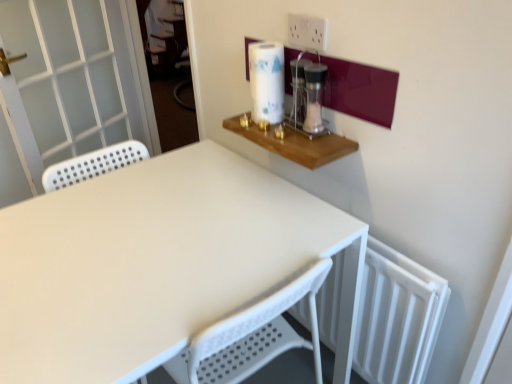
Locate an element on the screen. The image size is (512, 384). white glossy paper towel at upper right is located at coordinates (267, 81).

Identify the location of clear glass jar at upper right. (307, 95).

Locate an element on the screen. The image size is (512, 384). white perforated screen door at left is located at coordinates (74, 79).

The image size is (512, 384). What do you see at coordinates (307, 32) in the screenshot? I see `white plastic electric outlet at upper center` at bounding box center [307, 32].

Describe the element at coordinates (158, 264) in the screenshot. The width and height of the screenshot is (512, 384). I see `white matte table at center` at that location.

Where is `white glossy paper towel at upper right`? white glossy paper towel at upper right is located at coordinates (267, 81).

Does white perforated screen door at left have a lesser width compared to white glossy paper towel at upper right?

No, white perforated screen door at left is not thinner than white glossy paper towel at upper right.

From the image's perspective, between white perforated screen door at left and white glossy paper towel at upper right, who is located below?

From the image's view, white glossy paper towel at upper right is below.

Does white perforated screen door at left contain white glossy paper towel at upper right?

Definitely not — white glossy paper towel at upper right is not inside white perforated screen door at left.

From a real-world perspective, which is physically below, white perforated screen door at left or white glossy paper towel at upper right?

From a 3D spatial view, white perforated screen door at left is below.

Identify the location of screen door lying behind the white matte table at center. click(74, 79).

Considering the positions of objects white matte table at center and white perforated screen door at left in the image provided, who is more to the left, white matte table at center or white perforated screen door at left?

From the viewer's perspective, white perforated screen door at left appears more on the left side.

Based on the photo, is white matte table at center far from white perforated screen door at left?

Absolutely, white matte table at center is distant from white perforated screen door at left.

Is white matte table at center closer to camera compared to white perforated screen door at left?

Yes, it is.

Considering the sizes of objects clear glass salt shaker at upper center and white glossy paper towel at upper right in the image provided, who is bigger, clear glass salt shaker at upper center or white glossy paper towel at upper right?

white glossy paper towel at upper right.

From a real-world perspective, between clear glass salt shaker at upper center and white glossy paper towel at upper right, who is vertically lower?

In real-world perspective, clear glass salt shaker at upper center is lower.

Considering the points (298, 83) and (254, 120), which point is in front, point (298, 83) or point (254, 120)?

Point (298, 83)

Consider the image. Is clear glass salt shaker at upper center to the left of white glossy paper towel at upper right from the viewer's perspective?

In fact, clear glass salt shaker at upper center is to the right of white glossy paper towel at upper right.

How different are the orientations of white perforated screen door at left and white matte table at center in degrees?

white perforated screen door at left and white matte table at center are facing 156 degrees away from each other.

Considering the relative sizes of white perforated screen door at left and white matte table at center in the image provided, is white perforated screen door at left shorter than white matte table at center?

No, white perforated screen door at left is not shorter than white matte table at center.

Looking at the image, does white perforated screen door at left seem bigger or smaller compared to white matte table at center?

white perforated screen door at left is smaller than white matte table at center.

Choose the correct answer: Is white perforated screen door at left inside white matte table at center or outside it?

white perforated screen door at left lies outside white matte table at center.

Considering the relative sizes of white glossy paper towel at upper right and clear glass jar at upper right in the image provided, is white glossy paper towel at upper right wider than clear glass jar at upper right?

Correct, the width of white glossy paper towel at upper right exceeds that of clear glass jar at upper right.

Is white glossy paper towel at upper right taller or shorter than clear glass jar at upper right?

Considering their sizes, white glossy paper towel at upper right has more height than clear glass jar at upper right.

From the image's perspective, between white glossy paper towel at upper right and clear glass jar at upper right, who is located below?

clear glass jar at upper right appears lower in the image.

From the image's perspective, is white plastic electric outlet at upper center beneath white glossy paper towel at upper right?

Incorrect, from the image's perspective, white plastic electric outlet at upper center is higher than white glossy paper towel at upper right.

Is white plastic electric outlet at upper center positioned with its back to white glossy paper towel at upper right?

No, white plastic electric outlet at upper center is not facing away from white glossy paper towel at upper right.

Can you confirm if white plastic electric outlet at upper center is shorter than white glossy paper towel at upper right?

Correct, white plastic electric outlet at upper center is not as tall as white glossy paper towel at upper right.

From a real-world perspective, between white plastic electric outlet at upper center and white glossy paper towel at upper right, who is vertically lower?

In real-world perspective, white glossy paper towel at upper right is lower.

From a real-world perspective, which is physically above, clear glass jar at upper right or white matte table at center?

clear glass jar at upper right, from a real-world perspective.

Relative to white matte table at center, is clear glass jar at upper right in front or behind?

Visually, clear glass jar at upper right is located behind white matte table at center.

What are the coordinates of `coffee machine above the white matte table at center (from a real-world perspective)` in the screenshot? It's located at (307, 95).

Locate an element on the screen. screen door on the left of white glossy paper towel at upper right is located at coordinates (74, 79).

You are a GUI agent. You are given a task and a screenshot of the screen. Output one action in this format:
    pyautogui.click(x=<x>, y=<y>)
    Task: Click on the table below the white perforated screen door at left (from a real-world perspective)
    Image resolution: width=512 pixels, height=384 pixels.
    Given the screenshot: What is the action you would take?
    pyautogui.click(x=158, y=264)

From the image, which object appears to be farther from clear glass salt shaker at upper center, white matte table at center or white plastic electric outlet at upper center?

Based on the image, white matte table at center appears to be further to clear glass salt shaker at upper center.

Considering their positions, is clear glass salt shaker at upper center positioned further to white plastic electric outlet at upper center than white perforated screen door at left?

Among the two, white perforated screen door at left is located further to white plastic electric outlet at upper center.

When comparing their distances from clear glass salt shaker at upper center, does white perforated screen door at left or white glossy paper towel at upper right seem closer?

The object closer to clear glass salt shaker at upper center is white glossy paper towel at upper right.

Which object lies further to the anchor point white plastic electric outlet at upper center, white glossy paper towel at upper right or clear glass jar at upper right?

white glossy paper towel at upper right.

From the image, which object appears to be farther from clear glass salt shaker at upper center, white perforated screen door at left or white plastic electric outlet at upper center?

white perforated screen door at left is further to clear glass salt shaker at upper center.

From the image, which object appears to be nearer to white perforated screen door at left, clear glass salt shaker at upper center or white plastic electric outlet at upper center?

clear glass salt shaker at upper center is closer to white perforated screen door at left.

Which object lies further to the anchor point clear glass salt shaker at upper center, clear glass jar at upper right or white matte table at center?

white matte table at center.

From the image, which object appears to be farther from clear glass jar at upper right, clear glass salt shaker at upper center or white glossy paper towel at upper right?

Based on the image, white glossy paper towel at upper right appears to be further to clear glass jar at upper right.

In order to click on paper towel between white plastic electric outlet at upper center and clear glass jar at upper right vertically in this screenshot , I will do `click(267, 81)`.

I want to click on table located between white perforated screen door at left and white plastic electric outlet at upper center in the left-right direction, so click(158, 264).

In order to click on paper towel between white perforated screen door at left and clear glass jar at upper right in this screenshot , I will do `click(267, 81)`.

Locate an element on the screen. appliance between white glossy paper towel at upper right and clear glass jar at upper right is located at coordinates (298, 89).